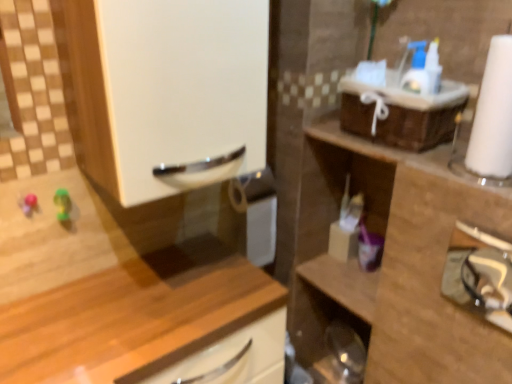
Locate an element on the screen. The image size is (512, 384). free region under white glossy cabinet handle at upper left (from a real-world perspective) is located at coordinates (183, 276).